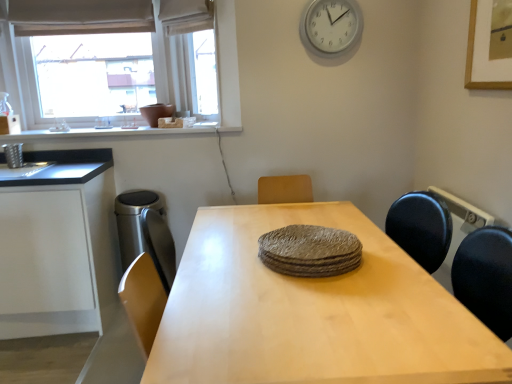
Identify the location of free space above white plastic clock at upper center (from a real-world perspective). (333, 0).